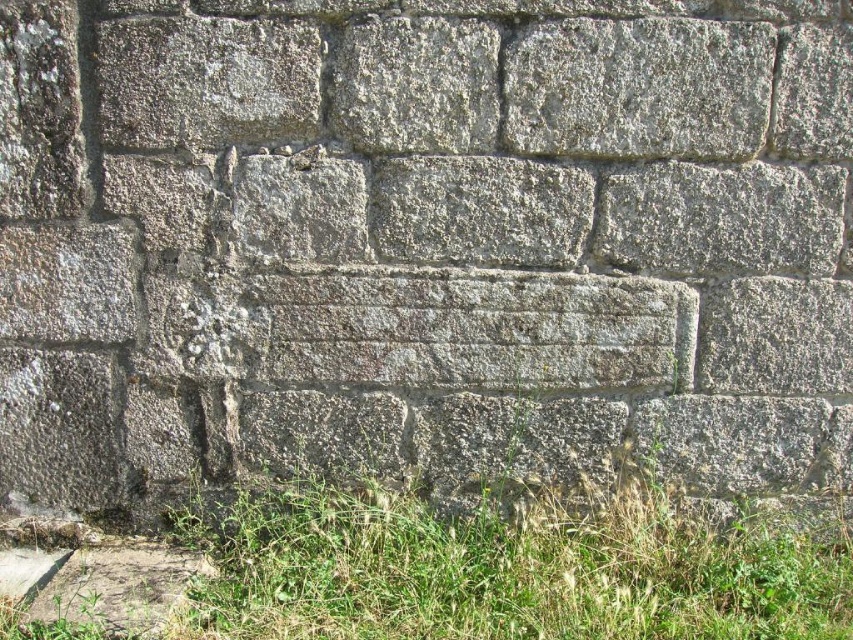
Between point (693, 608) and point (637, 28), which one is positioned behind?

The point (693, 608) is more distant.

Is point (537, 627) behind point (682, 76)?

No, it is in front of (682, 76).

Where is `green grass at lower left`? The image size is (853, 640). green grass at lower left is located at coordinates (508, 566).